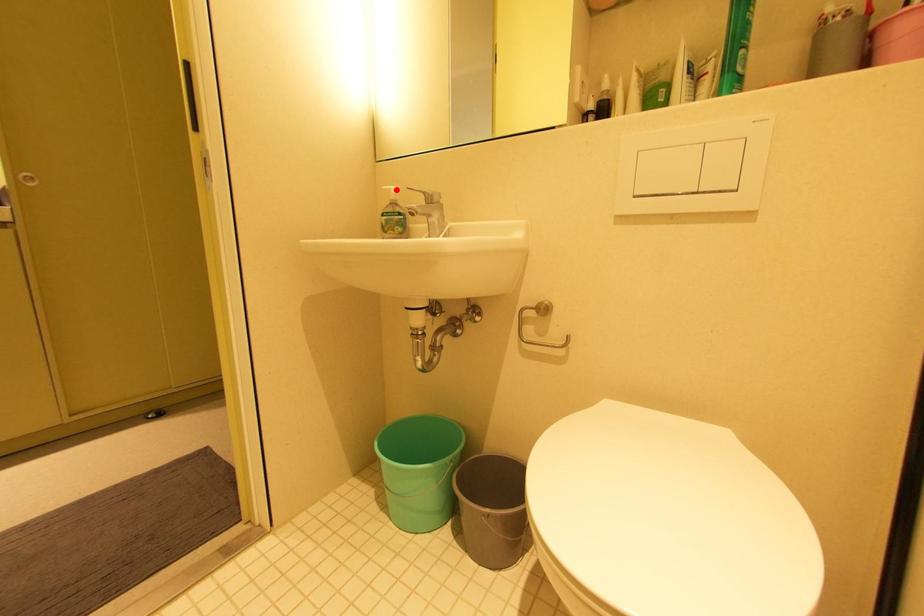
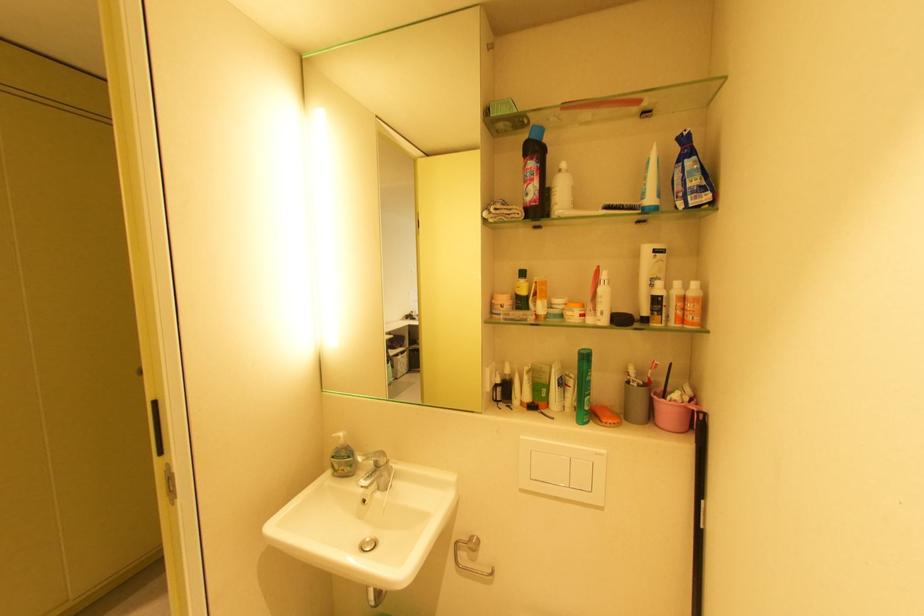
Find the pixel in the second image that matches the highlighted location in the first image.

(346, 438)